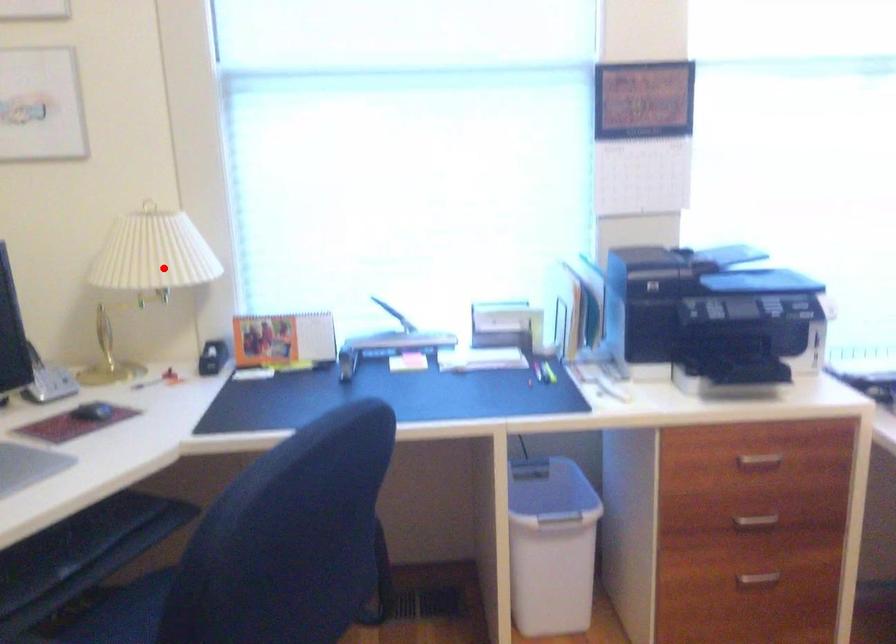
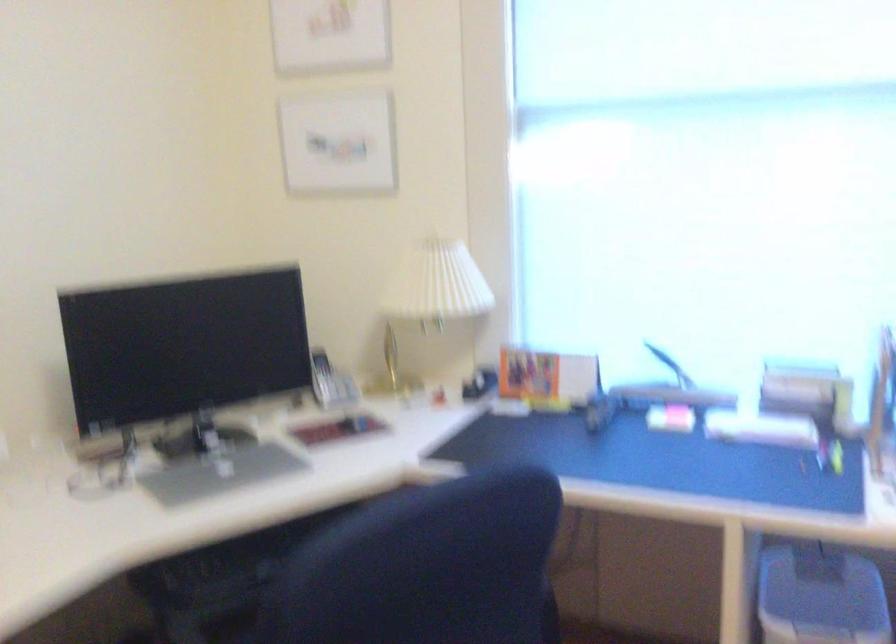
Find the pixel in the second image that matches the highlighted location in the first image.

(433, 295)